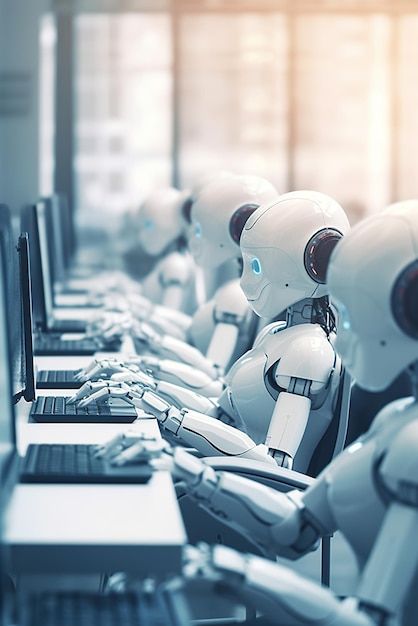
At what (x,y) coordinates should I click in order to perform the action: click on computer keyboards. Please return your answer as a coordinate pair (x, y). Looking at the image, I should click on (100, 601), (83, 471), (65, 404), (64, 381), (65, 337), (69, 317), (76, 299), (80, 290), (85, 275), (87, 265).